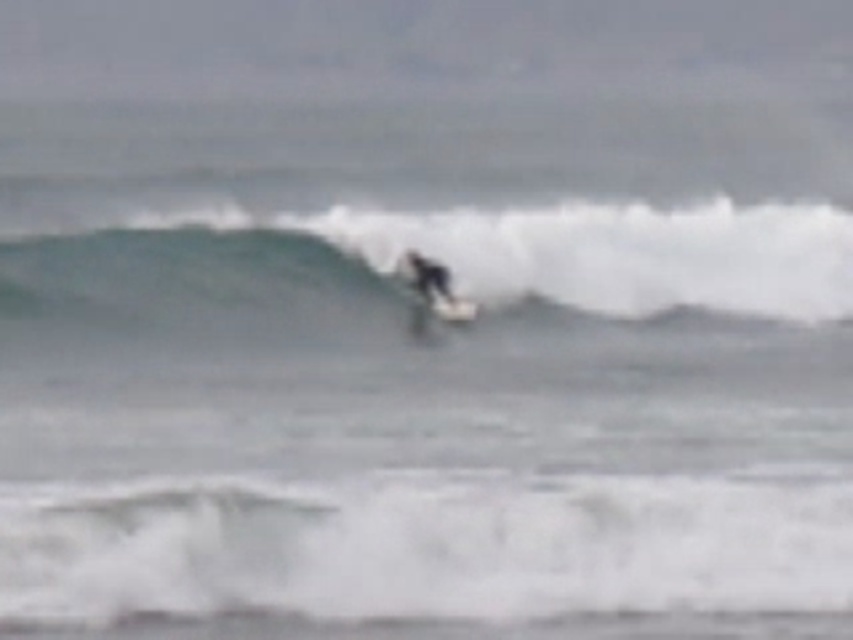
You are a photographer trying to capture the surfer on the green rubber surfboard at center and the white matte surfboard at center. Which surfboard should you focus on if you want to capture one that is higher in the frame?

The green rubber surfboard at center is located above the white matte surfboard at center, so you should focus on the green rubber surfboard at center to capture the one higher in the frame.

You are a photographer trying to capture both the green rubber surfboard at center and the white matte surfboard at center in a single shot. Based on their positions, which surfboard should you focus on first to ensure both are in frame?

The green rubber surfboard at center is to the left of the white matte surfboard at center, so focusing on the white matte surfboard at center first would allow you to adjust the frame to include both.

You are a surfer trying to choose between two surfboards in the image. The green rubber surfboard at center and the white matte surfboard at center. Which one is wider?

The green rubber surfboard at center might be wider than the white matte surfboard at center.